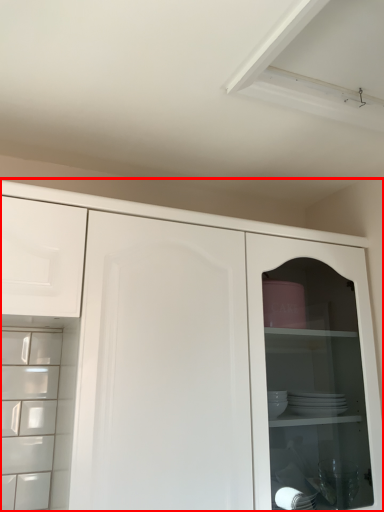
Question: Observing the image, what is the correct spatial positioning of cupboard (annotated by the red box) in reference to drawer?

Choices:
 (A) right
 (B) left

Answer: (A)